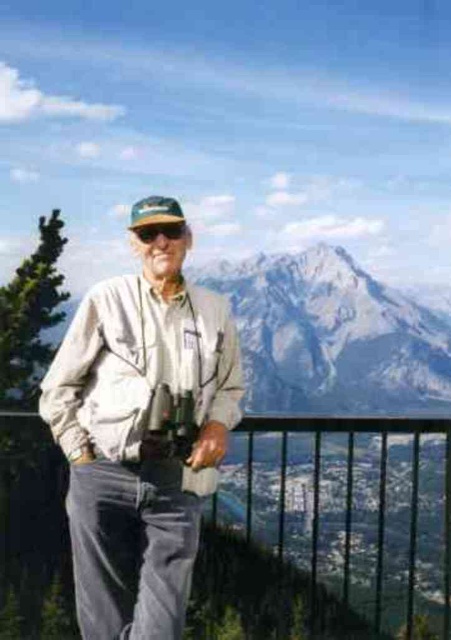
Question: Among these objects, which one is farthest from the camera?

Choices:
 (A) metallic silver binoculars at center
 (B) black matte sunglasses at center
 (C) green fabric cap at center
 (D) khaki fabric jacket at center

Answer: (B)

Question: Which of the following is the closest to the observer?

Choices:
 (A) black matte sunglasses at center
 (B) black metal fence at lower center

Answer: (A)

Question: Does khaki fabric jacket at center appear on the right side of green fabric cap at center?

Choices:
 (A) yes
 (B) no

Answer: (B)

Question: Is black metal fence at lower center bigger than khaki fabric jacket at center?

Choices:
 (A) yes
 (B) no

Answer: (A)

Question: Is black metal fence at lower center bigger than green fabric cap at center?

Choices:
 (A) yes
 (B) no

Answer: (A)

Question: Which point is farther from the camera taking this photo?

Choices:
 (A) (160, 496)
 (B) (432, 493)
 (C) (193, 413)

Answer: (B)